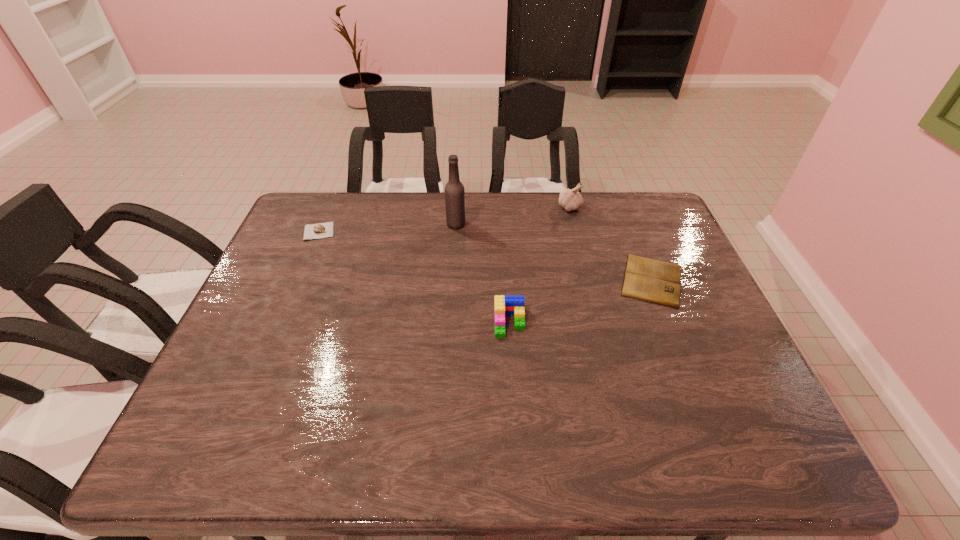
I want to click on free area in between the rightmost object and the fourth object from right to left, so click(x=554, y=252).

Where is `vacant point located between the beer bottle and the leftmost object`? Image resolution: width=960 pixels, height=540 pixels. vacant point located between the beer bottle and the leftmost object is located at coordinates (388, 228).

Where is `free area in between the beer bottle and the third object from left to right`? free area in between the beer bottle and the third object from left to right is located at coordinates (483, 273).

Where is `free space between the third object from right to left and the tallest object`? This screenshot has width=960, height=540. free space between the third object from right to left and the tallest object is located at coordinates pos(483,273).

Locate an element on the screen. free spot between the tallest object and the farthest object is located at coordinates (513, 216).

The height and width of the screenshot is (540, 960). Identify the location of vacant area that lies between the third shortest object and the left garlic. (414, 276).

Where is `object identified as the closest to the third object from left to right`? object identified as the closest to the third object from left to right is located at coordinates (x=654, y=281).

Identify which object is the third closest to the fourth object from right to left. Please provide its 2D coordinates. Your answer should be formatted as a tuple, i.e. [(x, y)], where the tuple contains the x and y coordinates of a point satisfying the conditions above.

[(319, 230)]

Locate an element on the screen. The width and height of the screenshot is (960, 540). blank space that satisfies the following two spatial constraints: 1. on the label of the fourth object from right to left; 2. on the front side of the second shortest object is located at coordinates (456, 231).

This screenshot has height=540, width=960. What are the coordinates of `vacant space that satisfies the following two spatial constraints: 1. on the front side of the nearer garlic; 2. on the right side of the third tallest object` in the screenshot? It's located at (280, 322).